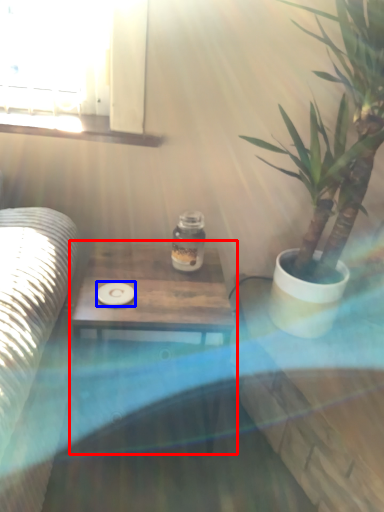
Question: Which object appears farthest to the camera in this image, table (highlighted by a red box) or coaster (highlighted by a blue box)?

Choices:
 (A) table
 (B) coaster

Answer: (B)